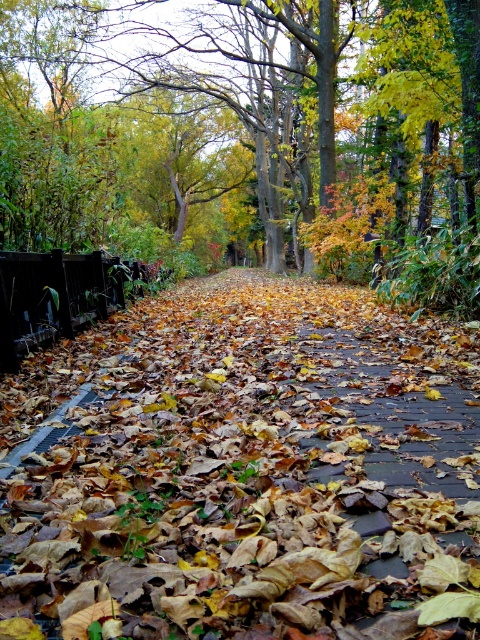
Is brown stone pavement at center above green leafy tree at center?

Actually, brown stone pavement at center is below green leafy tree at center.

Consider the image. Does brown stone pavement at center have a greater height compared to green leafy tree at center?

Incorrect, brown stone pavement at center's height is not larger of green leafy tree at center's.

Is point (377, 508) positioned in front of point (374, 140)?

That is True.

Where is `brown stone pavement at center`? The height and width of the screenshot is (640, 480). brown stone pavement at center is located at coordinates (249, 472).